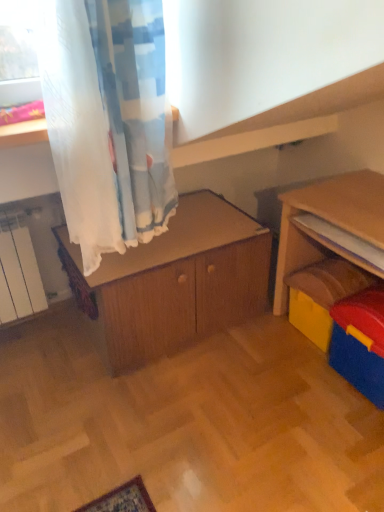
Question: Visually, is blue plastic storage box at lower right positioned to the left or to the right of yellow plastic toy at right?

Choices:
 (A) left
 (B) right

Answer: (B)

Question: From a real-world perspective, is blue plastic storage box at lower right physically located above or below yellow plastic toy at right?

Choices:
 (A) above
 (B) below

Answer: (A)

Question: Estimate the real-world distances between objects in this image. Which object is farther from the wooden cabinet at center?

Choices:
 (A) yellow plastic toy at right
 (B) blue plastic storage box at lower right
 (C) wooden bookshelf at right

Answer: (B)

Question: Considering the real-world distances, which object is farthest from the yellow plastic toy at right?

Choices:
 (A) wooden bookshelf at right
 (B) blue plastic storage box at lower right
 (C) wooden cabinet at center

Answer: (C)